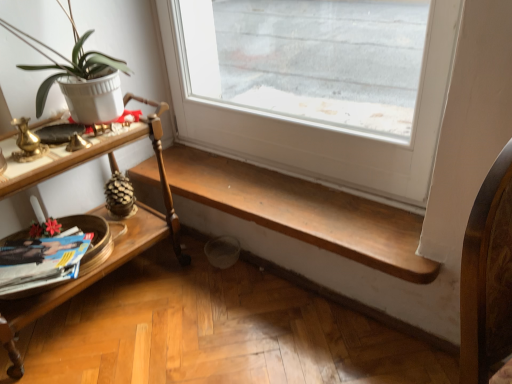
Question: Considering the relative positions of white matte pot at left and wooden bench at lower center in the image provided, is white matte pot at left to the right of wooden bench at lower center from the viewer's perspective?

Choices:
 (A) no
 (B) yes

Answer: (A)

Question: From the image's perspective, is white matte pot at left under wooden bench at lower center?

Choices:
 (A) no
 (B) yes

Answer: (A)

Question: From a real-world perspective, is white matte pot at left positioned under wooden bench at lower center based on gravity?

Choices:
 (A) no
 (B) yes

Answer: (A)

Question: From a real-world perspective, is white matte pot at left on wooden bench at lower center?

Choices:
 (A) no
 (B) yes

Answer: (B)

Question: Is the surface of white matte pot at left in direct contact with wooden bench at lower center?

Choices:
 (A) no
 (B) yes

Answer: (A)

Question: Does white matte pot at left have a greater width compared to wooden bench at lower center?

Choices:
 (A) no
 (B) yes

Answer: (A)

Question: Does woodenmaterial/textureshelf at left have a greater width compared to matte paper magazine at lower left?

Choices:
 (A) yes
 (B) no

Answer: (A)

Question: Is woodenmaterial/textureshelf at left facing away from matte paper magazine at lower left?

Choices:
 (A) no
 (B) yes

Answer: (B)

Question: Would you say woodenmaterial/textureshelf at left is a long distance from matte paper magazine at lower left?

Choices:
 (A) no
 (B) yes

Answer: (A)

Question: Does woodenmaterial/textureshelf at left lie behind matte paper magazine at lower left?

Choices:
 (A) no
 (B) yes

Answer: (A)

Question: Is woodenmaterial/textureshelf at left to the right of matte paper magazine at lower left from the viewer's perspective?

Choices:
 (A) no
 (B) yes

Answer: (B)

Question: Is woodenmaterial/textureshelf at left aimed at matte paper magazine at lower left?

Choices:
 (A) yes
 (B) no

Answer: (A)

Question: Is white matte pot at left positioned in front of woodenmaterial/textureshelf at left?

Choices:
 (A) no
 (B) yes

Answer: (B)